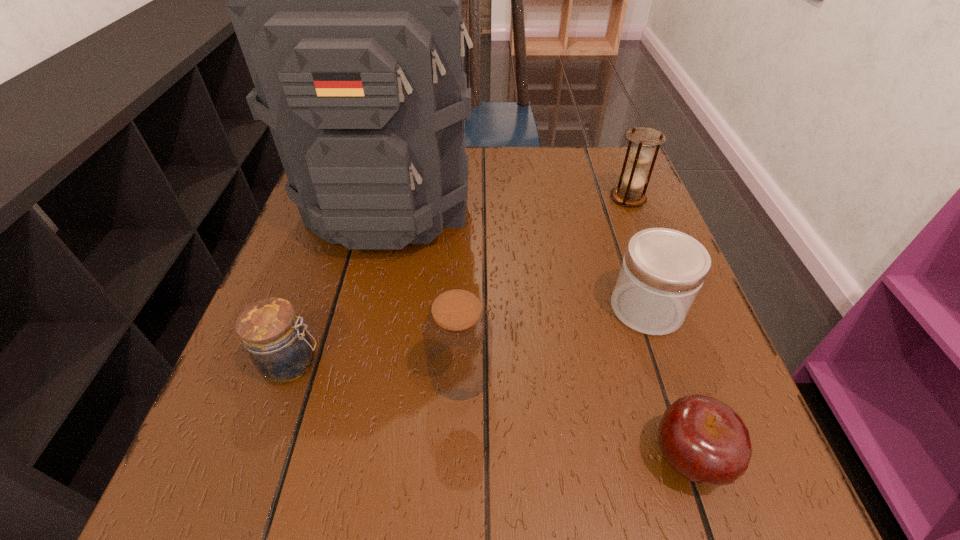
I want to click on vacant space located 0.050m on the front of the farthest jar, so pyautogui.click(x=665, y=362).

Where is `free point located 0.190m on the lid of the leftmost jar`? The image size is (960, 540). free point located 0.190m on the lid of the leftmost jar is located at coordinates coord(438,363).

Image resolution: width=960 pixels, height=540 pixels. I want to click on vacant area located on the back of the nearest object, so point(660,373).

The height and width of the screenshot is (540, 960). I want to click on backpack that is at the far edge, so click(346, 0).

Find the location of a particular element. This screenshot has width=960, height=540. hourglass that is at the far edge is located at coordinates (640, 155).

Identify the location of object at the near edge. Image resolution: width=960 pixels, height=540 pixels. (705, 441).

In order to click on backpack that is at the left edge in this screenshot , I will do `click(346, 0)`.

The image size is (960, 540). Identify the location of jar located at the left edge. (280, 348).

The height and width of the screenshot is (540, 960). In order to click on hourglass situated at the right edge in this screenshot , I will do `click(640, 155)`.

Where is `jar at the right edge`? This screenshot has height=540, width=960. jar at the right edge is located at coordinates (663, 270).